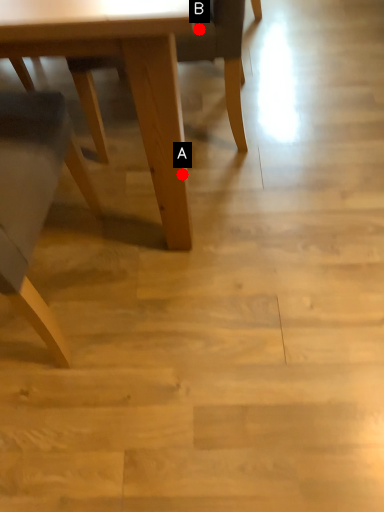
Question: Two points are circled on the image, labeled by A and B beside each circle. Which point is closer to the camera taking this photo?

Choices:
 (A) A is closer
 (B) B is closer

Answer: (A)